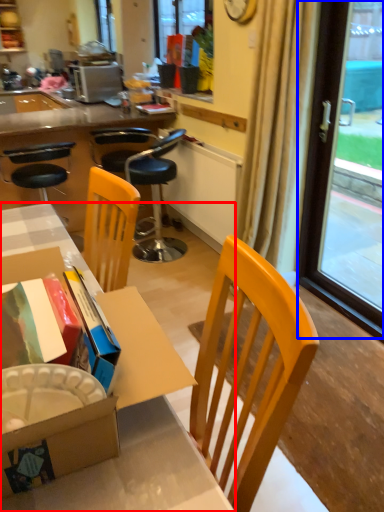
Question: Which object is closer to the camera taking this photo, desk (highlighted by a red box) or window screen (highlighted by a blue box)?

Choices:
 (A) desk
 (B) window screen

Answer: (A)